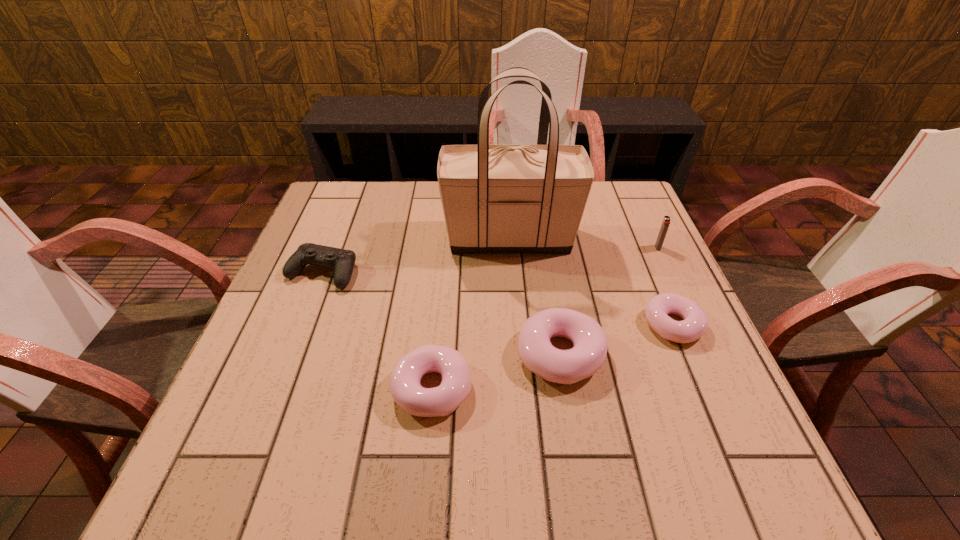
Where is `vacant space located 0.270m with handles facing forward on the shopping bag`? vacant space located 0.270m with handles facing forward on the shopping bag is located at coordinates (340, 239).

Where is `free space located 0.300m with handles facing forward on the shopping bag`? free space located 0.300m with handles facing forward on the shopping bag is located at coordinates (328, 239).

Locate an element on the screen. The height and width of the screenshot is (540, 960). vacant space located 0.110m with handles facing forward on the shopping bag is located at coordinates (401, 239).

Where is `free space located on the left of the igniter`? The image size is (960, 540). free space located on the left of the igniter is located at coordinates (596, 248).

I want to click on vacant space located 0.060m on the right of the control, so click(382, 273).

You are a GUI agent. You are given a task and a screenshot of the screen. Output one action in this format:
    pyautogui.click(x=<x>, y=<y>)
    Task: Click on the object that is at the far edge
    This screenshot has width=960, height=540.
    Given the screenshot: What is the action you would take?
    pyautogui.click(x=496, y=198)

Find the location of a particular element. The height and width of the screenshot is (540, 960). object located at the left edge is located at coordinates (342, 261).

At what (x,y) coordinates should I click in order to perform the action: click on doughnut located at the right edge. Please return your answer as a coordinate pair (x, y). The image size is (960, 540). Looking at the image, I should click on (695, 322).

This screenshot has height=540, width=960. What are the coordinates of `igniter that is at the right edge` in the screenshot? It's located at [x=666, y=221].

At what (x,y) coordinates should I click in order to perform the action: click on free space at the far edge of the desktop. Please return your answer as a coordinate pair (x, y). This screenshot has height=540, width=960. Looking at the image, I should click on (382, 186).